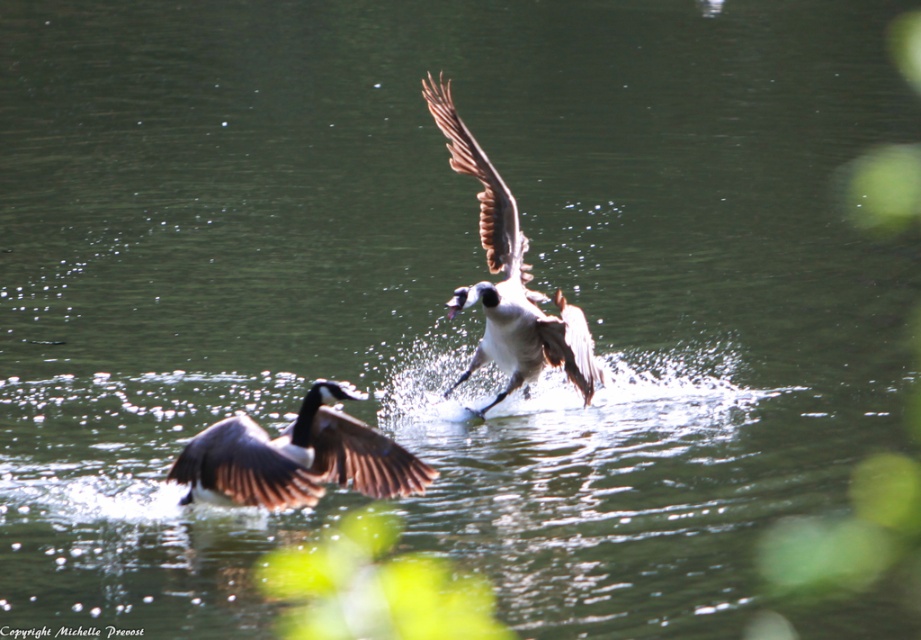
Does brown feathered goose at center have a greater height compared to white feathered goose at center?

No, brown feathered goose at center is not taller than white feathered goose at center.

Measure the distance between brown feathered goose at center and white feathered goose at center.

A distance of 2.53 meters exists between brown feathered goose at center and white feathered goose at center.

Is point (310, 428) positioned after point (517, 308)?

That is False.

Identify the location of brown feathered goose at center. (295, 458).

Is brown feathered goose at center smaller than brown feathered wing at upper center?

No.

Image resolution: width=921 pixels, height=640 pixels. I want to click on brown feathered goose at center, so click(295, 458).

Is point (271, 456) closer to camera compared to point (492, 180)?

Yes, point (271, 456) is closer to viewer.

In order to click on brown feathered goose at center in this screenshot , I will do `click(295, 458)`.

Does white feathered goose at center appear on the right side of brown feathered wing at upper center?

In fact, white feathered goose at center is to the left of brown feathered wing at upper center.

Can you confirm if white feathered goose at center is shorter than brown feathered wing at upper center?

In fact, white feathered goose at center may be taller than brown feathered wing at upper center.

Image resolution: width=921 pixels, height=640 pixels. What do you see at coordinates (508, 276) in the screenshot?
I see `white feathered goose at center` at bounding box center [508, 276].

Locate an element on the screen. The width and height of the screenshot is (921, 640). white feathered goose at center is located at coordinates (508, 276).